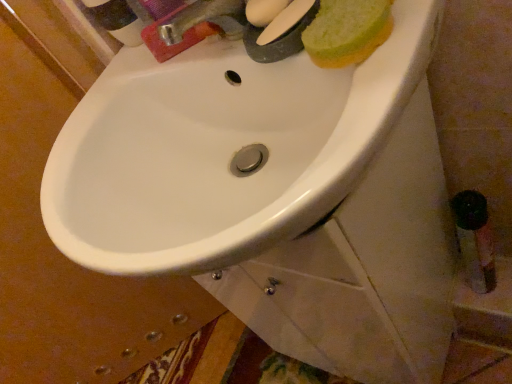
Question: Is metallic silver faucet at upper center further to the viewer compared to white glossy sink at center?

Choices:
 (A) no
 (B) yes

Answer: (B)

Question: Does metallic silver faucet at upper center have a greater height compared to white glossy sink at center?

Choices:
 (A) no
 (B) yes

Answer: (A)

Question: Considering the relative sizes of metallic silver faucet at upper center and white glossy sink at center in the image provided, is metallic silver faucet at upper center smaller than white glossy sink at center?

Choices:
 (A) no
 (B) yes

Answer: (B)

Question: Does metallic silver faucet at upper center appear on the right side of white glossy sink at center?

Choices:
 (A) no
 (B) yes

Answer: (A)

Question: Can you confirm if metallic silver faucet at upper center is bigger than white glossy sink at center?

Choices:
 (A) yes
 (B) no

Answer: (B)

Question: From the image's perspective, relative to green sponge at upper right, is white glossy sink at center above or below?

Choices:
 (A) below
 (B) above

Answer: (A)

Question: Would you say white glossy sink at center is inside or outside green sponge at upper right?

Choices:
 (A) outside
 (B) inside

Answer: (A)

Question: Considering their positions, is white glossy sink at center located in front of or behind green sponge at upper right?

Choices:
 (A) behind
 (B) front

Answer: (B)

Question: From a real-world perspective, is white glossy sink at center physically located above or below green sponge at upper right?

Choices:
 (A) above
 (B) below

Answer: (B)

Question: Looking at the image, does metallic silver faucet at upper center seem bigger or smaller compared to green sponge at upper right?

Choices:
 (A) small
 (B) big

Answer: (A)

Question: Considering the positions of metallic silver faucet at upper center and green sponge at upper right in the image, is metallic silver faucet at upper center wider or thinner than green sponge at upper right?

Choices:
 (A) thin
 (B) wide

Answer: (A)

Question: Choose the correct answer: Is metallic silver faucet at upper center inside green sponge at upper right or outside it?

Choices:
 (A) inside
 (B) outside

Answer: (B)

Question: In the image, is metallic silver faucet at upper center on the left side or the right side of green sponge at upper right?

Choices:
 (A) right
 (B) left

Answer: (B)

Question: Visually, is green sponge at upper right positioned to the left or to the right of white glossy sink at center?

Choices:
 (A) right
 (B) left

Answer: (A)

Question: Does point (340, 61) appear closer or farther from the camera than point (262, 203)?

Choices:
 (A) farther
 (B) closer

Answer: (B)